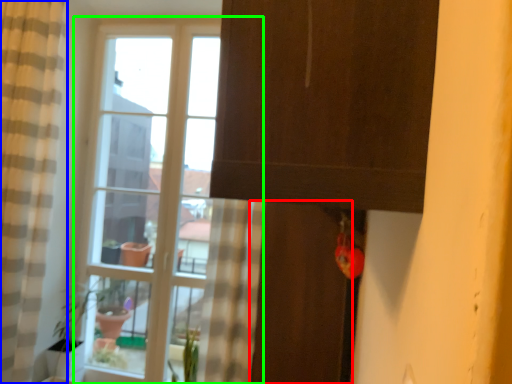
Question: Which object is the farthest from screen door (highlighted by a red box)? Choose among these: curtain (highlighted by a blue box) or window (highlighted by a green box).

Choices:
 (A) curtain
 (B) window

Answer: (A)